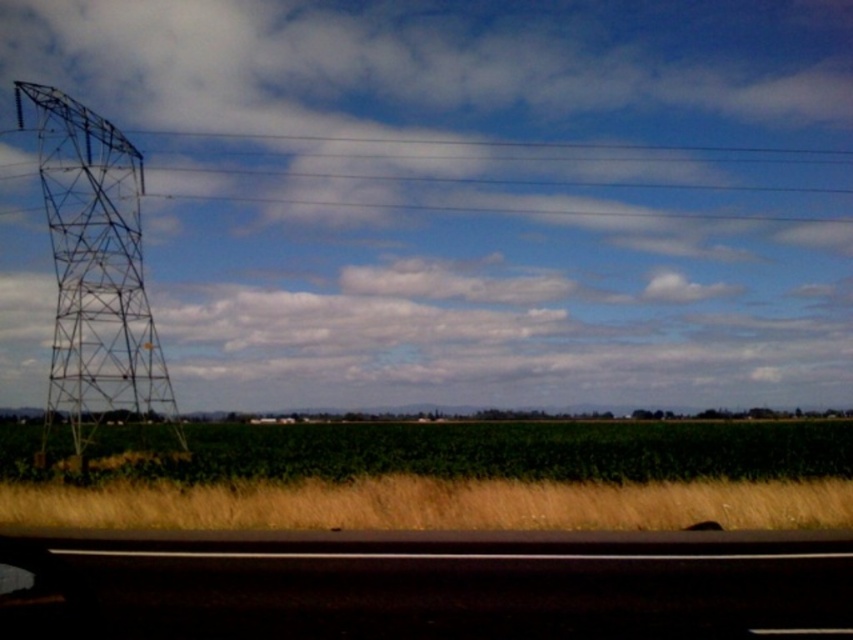
Question: Which point is farther from the camera taking this photo?

Choices:
 (A) (96, 259)
 (B) (469, 584)

Answer: (A)

Question: Where is black asphalt highway at lower center located in relation to yellow grass at lower center in the image?

Choices:
 (A) right
 (B) left

Answer: (B)

Question: Where is black asphalt highway at lower center located in relation to metallic grid tower at left in the image?

Choices:
 (A) above
 (B) below

Answer: (B)

Question: Which of the following is the closest to the observer?

Choices:
 (A) metallic grid tower at left
 (B) black asphalt highway at lower center

Answer: (B)

Question: Estimate the real-world distances between objects in this image. Which object is farther from the metallic grid tower at left?

Choices:
 (A) yellow grass at lower center
 (B) black asphalt highway at lower center

Answer: (B)

Question: Can you confirm if black asphalt highway at lower center is smaller than yellow grass at lower center?

Choices:
 (A) no
 (B) yes

Answer: (A)